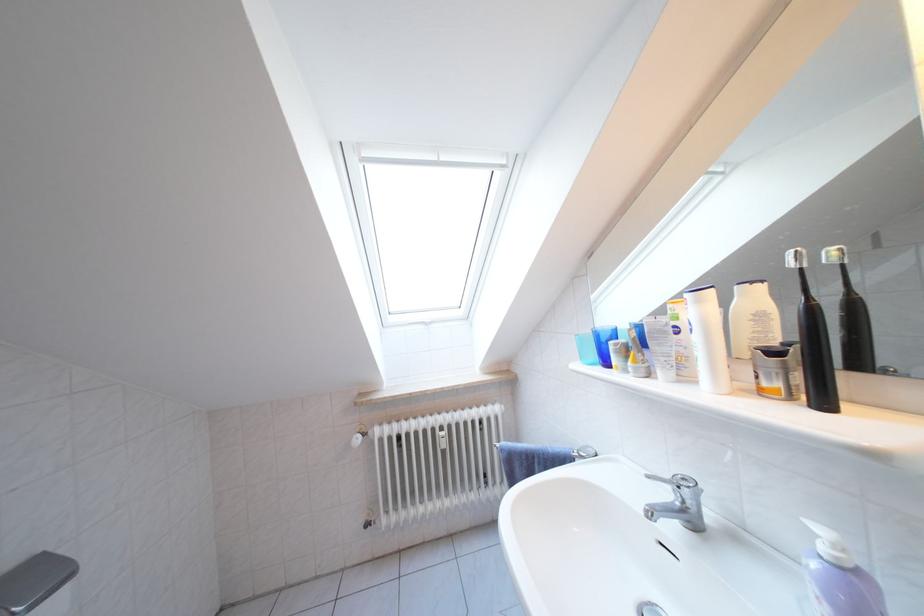
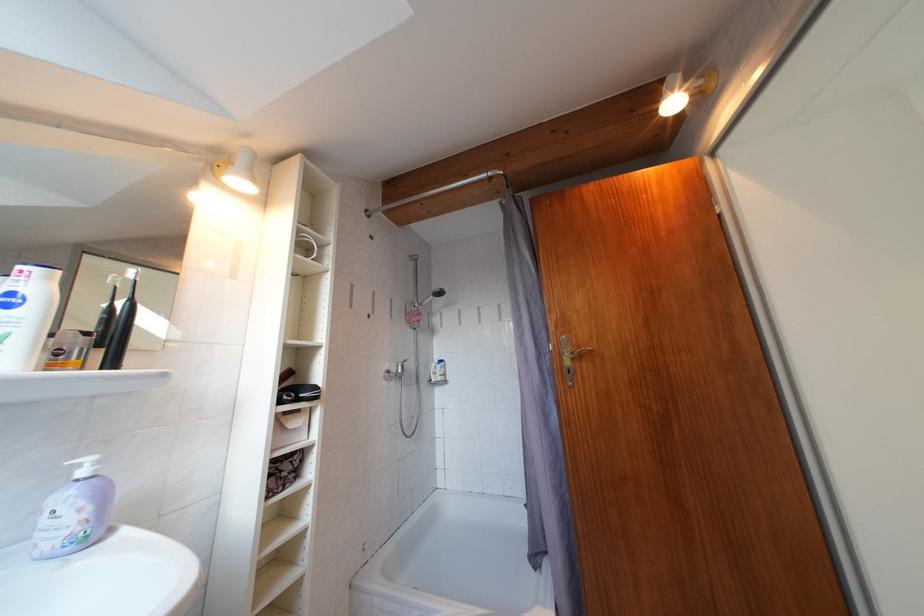
The point at (708, 306) is marked in the first image. Where is the corresponding point in the second image?

(56, 283)